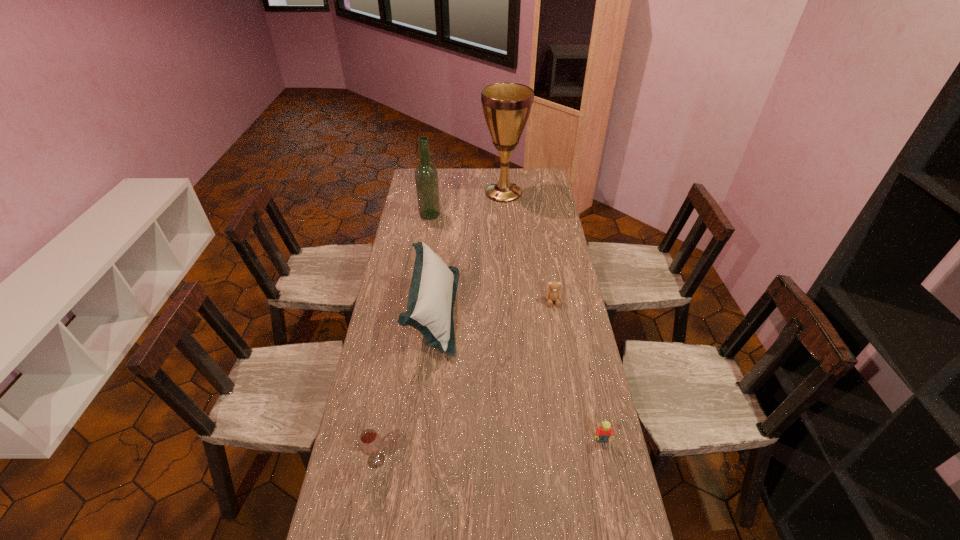
Locate an element on the screen. Image resolution: width=960 pixels, height=540 pixels. trophy cup present at the right edge is located at coordinates (506, 106).

Identify the location of Lego at the right edge. The height and width of the screenshot is (540, 960). (605, 431).

The image size is (960, 540). I want to click on teddy bear at the right edge, so click(553, 294).

Identify the location of object located in the far right corner section of the desktop. This screenshot has width=960, height=540. (506, 106).

Image resolution: width=960 pixels, height=540 pixels. In the image, there is a desktop. Find the location of `free space at the far edge`. free space at the far edge is located at coordinates (464, 177).

Image resolution: width=960 pixels, height=540 pixels. Identify the location of free space at the left edge of the desktop. (372, 428).

Where is `blank space at the right edge`? The image size is (960, 540). blank space at the right edge is located at coordinates (546, 208).

Find the location of `vacant region between the trophy cup and the second nearest object`. vacant region between the trophy cup and the second nearest object is located at coordinates (553, 317).

Where is `free space between the second tallest object and the Lego`? The image size is (960, 540). free space between the second tallest object and the Lego is located at coordinates (x=516, y=328).

Where is `vacant area between the cushion and the third shortest object`? vacant area between the cushion and the third shortest object is located at coordinates (405, 386).